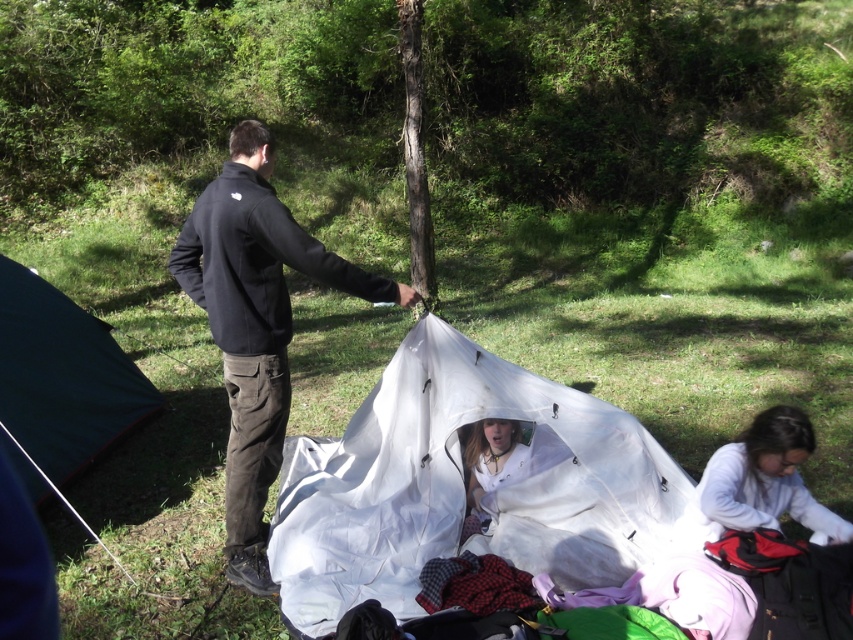
Question: Is dark green tarp at left above white matte jacket at lower right?

Choices:
 (A) no
 (B) yes

Answer: (B)

Question: Is dark green tarp at left positioned behind brown rough bark tree at center?

Choices:
 (A) yes
 (B) no

Answer: (B)

Question: Which point appears closest to the camera in this image?

Choices:
 (A) (740, 525)
 (B) (410, 144)
 (C) (212, 273)
 (D) (70, 310)

Answer: (A)

Question: Is white nylon tent at center bigger than black matte jacket at center?

Choices:
 (A) no
 (B) yes

Answer: (B)

Question: Which of the following is the closest to the observer?

Choices:
 (A) brown rough bark tree at center
 (B) white matte jacket at lower right

Answer: (B)

Question: Estimate the real-world distances between objects in this image. Which object is farther from the brown rough bark tree at center?

Choices:
 (A) white matte jacket at lower right
 (B) dark green tarp at left
 (C) black matte jacket at center
 (D) white nylon tent at center

Answer: (A)